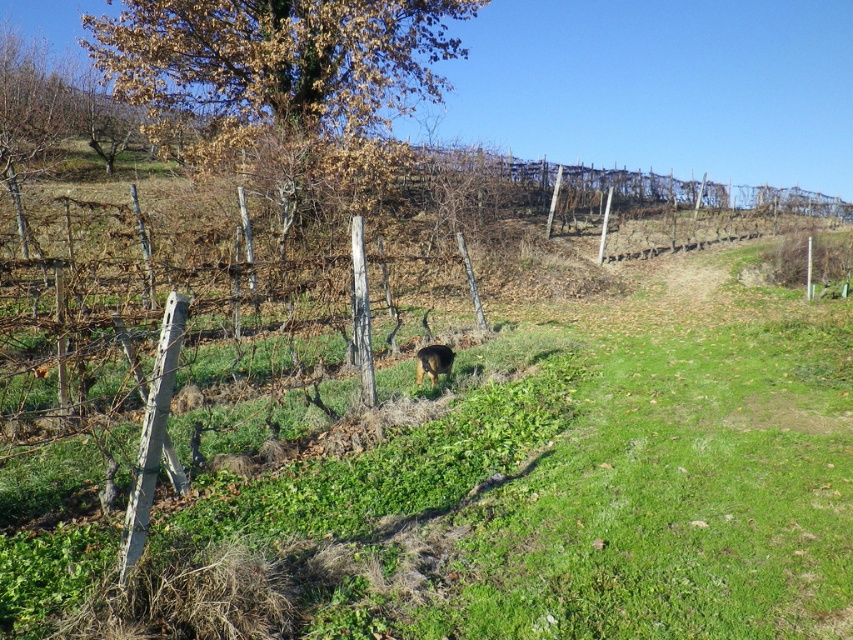
Question: Observing the image, what is the correct spatial positioning of brown leafy tree at upper left in reference to brown furry dog at center?

Choices:
 (A) above
 (B) below

Answer: (A)

Question: Among these points, which one is nearest to the camera?

Choices:
 (A) (167, 88)
 (B) (416, 355)

Answer: (B)

Question: Is brown leafy tree at upper left below brown furry dog at center?

Choices:
 (A) no
 (B) yes

Answer: (A)

Question: Is brown leafy tree at upper left positioned before brown furry dog at center?

Choices:
 (A) no
 (B) yes

Answer: (A)

Question: Which of the following is the closest to the observer?

Choices:
 (A) (421, 369)
 (B) (265, 32)

Answer: (A)

Question: Which point is farther to the camera?

Choices:
 (A) (279, 81)
 (B) (440, 358)

Answer: (A)